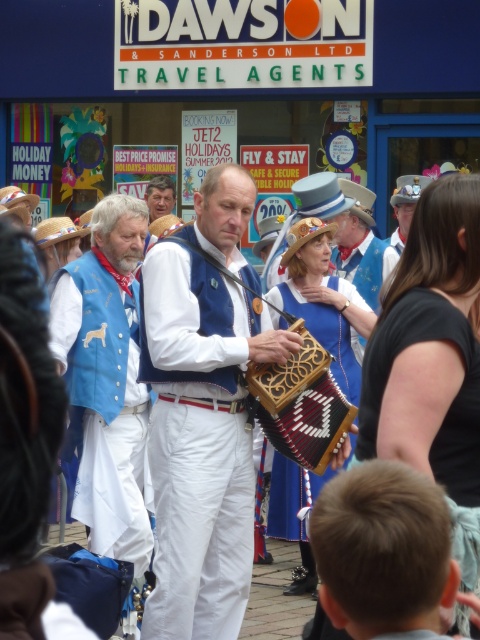
Question: Does wooden/carved accordion at center appear on the left side of wooden accordion at center?

Choices:
 (A) yes
 (B) no

Answer: (A)

Question: Which point appears closest to the camera in this image?

Choices:
 (A) (365, 396)
 (B) (180, 474)
 (C) (113, 444)

Answer: (A)

Question: Does wooden accordion at center appear on the left side of blue denim vest at center?

Choices:
 (A) no
 (B) yes

Answer: (A)

Question: Which point is closer to the camera?

Choices:
 (A) blue denim vest at center
 (B) matte blue vest at upper right

Answer: (B)

Question: Does black fabric dress at center appear over wooden/carved accordion at center?

Choices:
 (A) yes
 (B) no

Answer: (A)

Question: Which of the following is the farthest from the observer?

Choices:
 (A) blue velvety vest at center
 (B) blue denim vest at center
 (C) wooden accordion at center

Answer: (B)